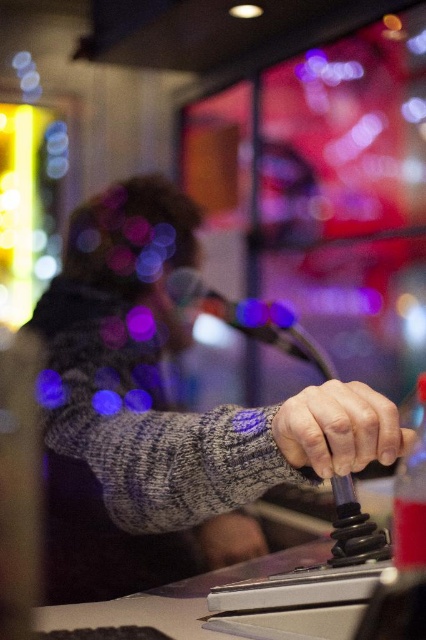
Between gray knitted sweater at center and smooth gray hand at center, which one is positioned higher?

gray knitted sweater at center is higher up.

Identify the location of gray knitted sweater at center. (161, 410).

Locate an element on the screen. Image resolution: width=426 pixels, height=640 pixels. gray knitted sweater at center is located at coordinates (161, 410).